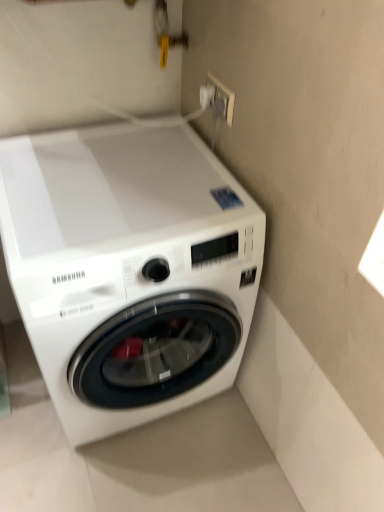
Question: Would you say white plastic socket at upper right is outside white glossy washing machine at lower left?

Choices:
 (A) yes
 (B) no

Answer: (A)

Question: Considering the relative sizes of white plastic socket at upper right and white glossy washing machine at lower left in the image provided, is white plastic socket at upper right thinner than white glossy washing machine at lower left?

Choices:
 (A) yes
 (B) no

Answer: (A)

Question: From the image's perspective, is white plastic socket at upper right below white glossy washing machine at lower left?

Choices:
 (A) yes
 (B) no

Answer: (B)

Question: Could you tell me if white plastic socket at upper right is turned towards white glossy washing machine at lower left?

Choices:
 (A) no
 (B) yes

Answer: (A)

Question: Does white plastic socket at upper right have a larger size compared to white glossy washing machine at lower left?

Choices:
 (A) yes
 (B) no

Answer: (B)

Question: Is the position of white plastic socket at upper right more distant than that of white glossy washing machine at lower left?

Choices:
 (A) yes
 (B) no

Answer: (A)

Question: Considering the relative sizes of white glossy washing machine at lower left and white plastic socket at upper right in the image provided, is white glossy washing machine at lower left thinner than white plastic socket at upper right?

Choices:
 (A) no
 (B) yes

Answer: (A)

Question: From a real-world perspective, is white glossy washing machine at lower left under white plastic socket at upper right?

Choices:
 (A) no
 (B) yes

Answer: (B)

Question: Does white glossy washing machine at lower left have a lesser height compared to white plastic socket at upper right?

Choices:
 (A) no
 (B) yes

Answer: (A)

Question: From the image's perspective, is white glossy washing machine at lower left under white plastic socket at upper right?

Choices:
 (A) no
 (B) yes

Answer: (B)

Question: Is white glossy washing machine at lower left not close to white plastic socket at upper right?

Choices:
 (A) no
 (B) yes

Answer: (A)

Question: Would you say white glossy washing machine at lower left is outside white plastic socket at upper right?

Choices:
 (A) no
 (B) yes

Answer: (B)

Question: Considering their positions, is white plastic socket at upper right located in front of or behind white glossy washing machine at lower left?

Choices:
 (A) front
 (B) behind

Answer: (B)